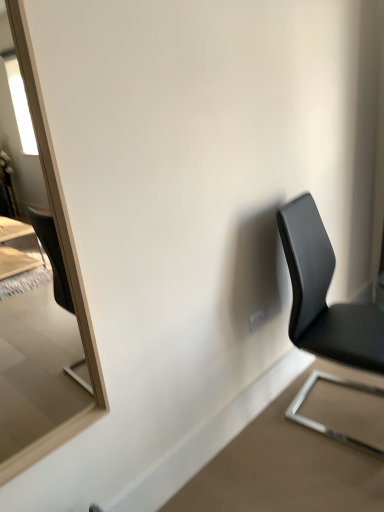
Find the location of a particular element. The width and height of the screenshot is (384, 512). free region under black leather chair at right (from a real-world perspective) is located at coordinates (342, 410).